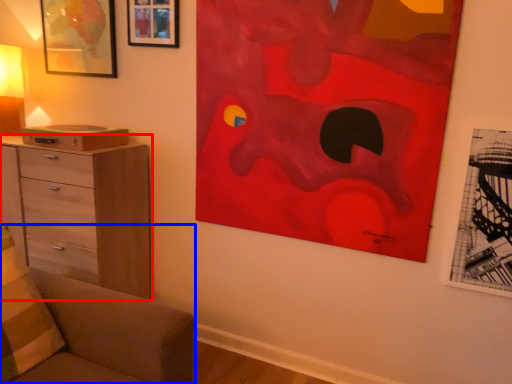
Question: Among these objects, which one is nearest to the camera, chest of drawers (highlighted by a red box) or furniture (highlighted by a blue box)?

Choices:
 (A) chest of drawers
 (B) furniture

Answer: (B)